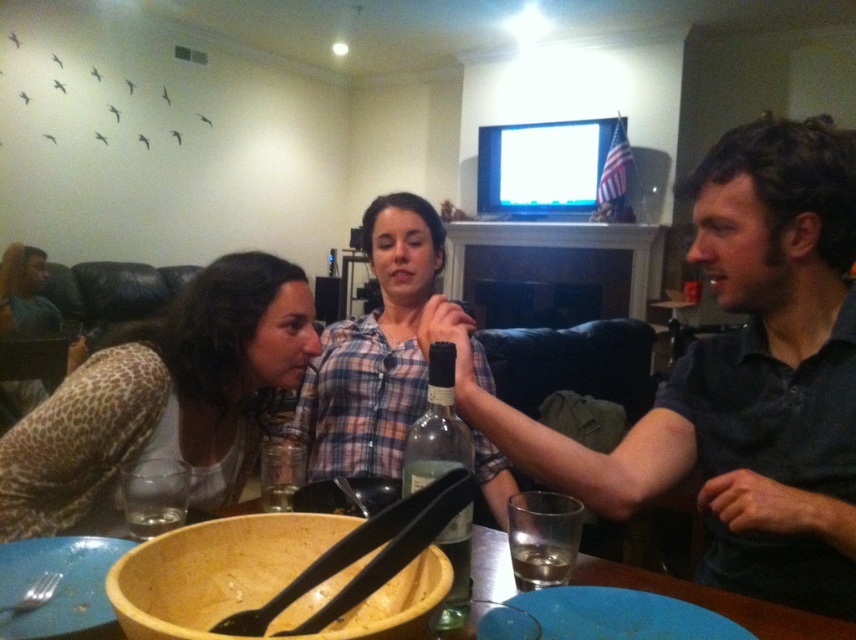
Question: Does transparent glass at lower center have a lesser width compared to metallic silver beverage at bowl center?

Choices:
 (A) yes
 (B) no

Answer: (B)

Question: Which of these objects is positioned farthest from the plaid shirt at center?

Choices:
 (A) giraffe print blouse at left
 (B) transparent glass at lower left
 (C) wooden bowl at center

Answer: (C)

Question: Among these points, which one is nearest to the camera?

Choices:
 (A) (553, 509)
 (B) (170, 467)
 (C) (331, 392)

Answer: (A)

Question: Is giraffe print blouse at left smaller than metallic silver beverage at bowl center?

Choices:
 (A) no
 (B) yes

Answer: (A)

Question: Can you confirm if giraffe print blouse at left is positioned to the left of plaid shirt at center?

Choices:
 (A) yes
 (B) no

Answer: (A)

Question: Which point appears farthest from the camera in this image?

Choices:
 (A) (788, 620)
 (B) (269, 442)
 (C) (158, 504)
 (D) (538, 557)

Answer: (B)